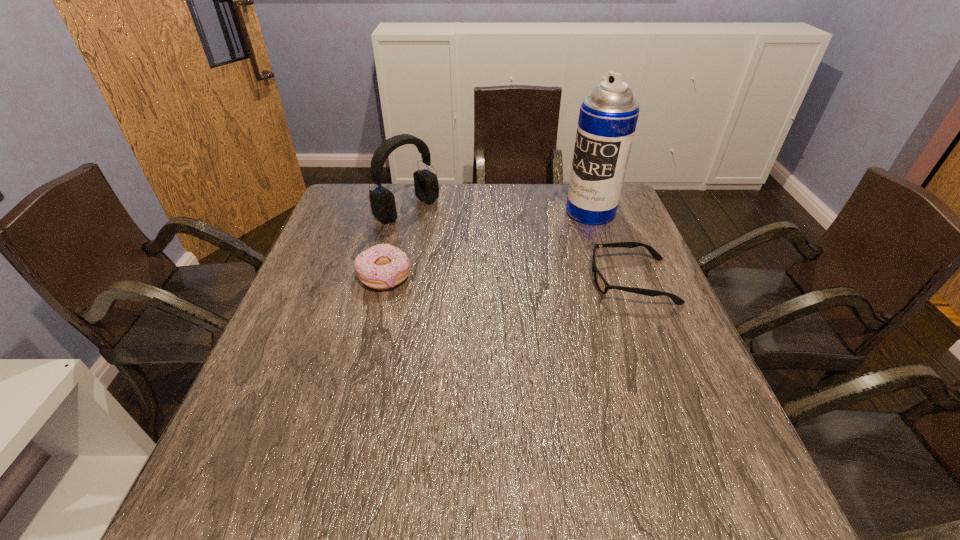
This screenshot has width=960, height=540. I want to click on vacant space on the desktop that is between the second shortest object and the shortest object and is positioned on the headband of the headset, so click(x=515, y=279).

You are a GUI agent. You are given a task and a screenshot of the screen. Output one action in this format:
    pyautogui.click(x=<x>, y=<y>)
    Task: Click on the free space on the desktop that is between the second shortest object and the spectacles and is positioned on the label side of the tallest object
    The image size is (960, 540).
    Given the screenshot: What is the action you would take?
    pyautogui.click(x=483, y=279)